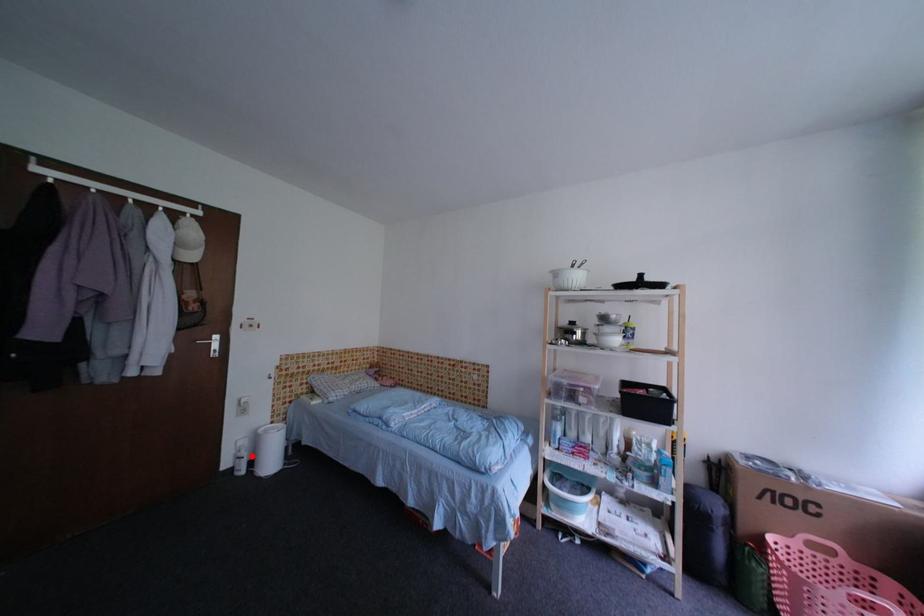
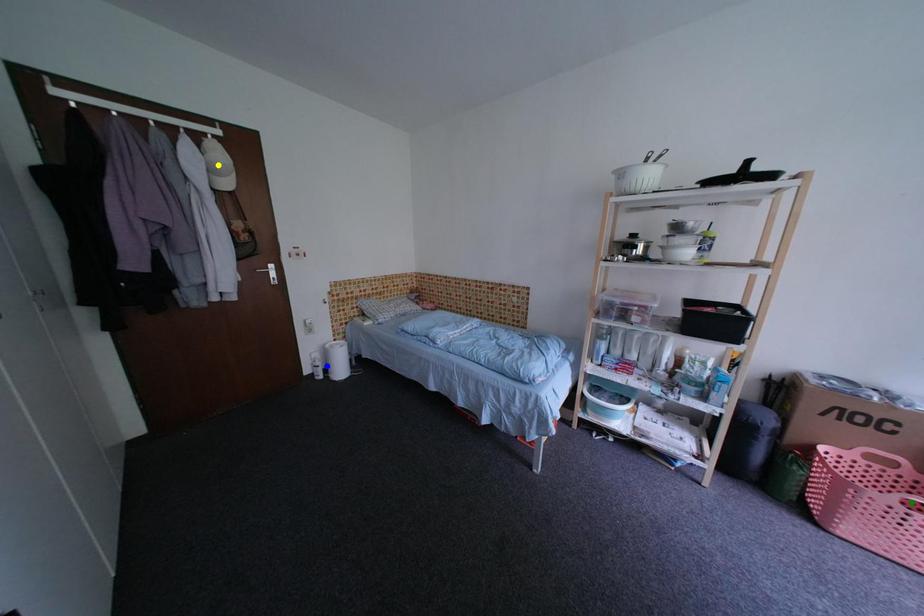
Question: I am providing you with two images of the same scene from different viewpoints. A red point is marked on the first image. You are given multiple points on the second image. Which point in image 2 is actually the same real-world point as the red point in image 1?

Choices:
 (A) green point
 (B) blue point
 (C) yellow point

Answer: (B)